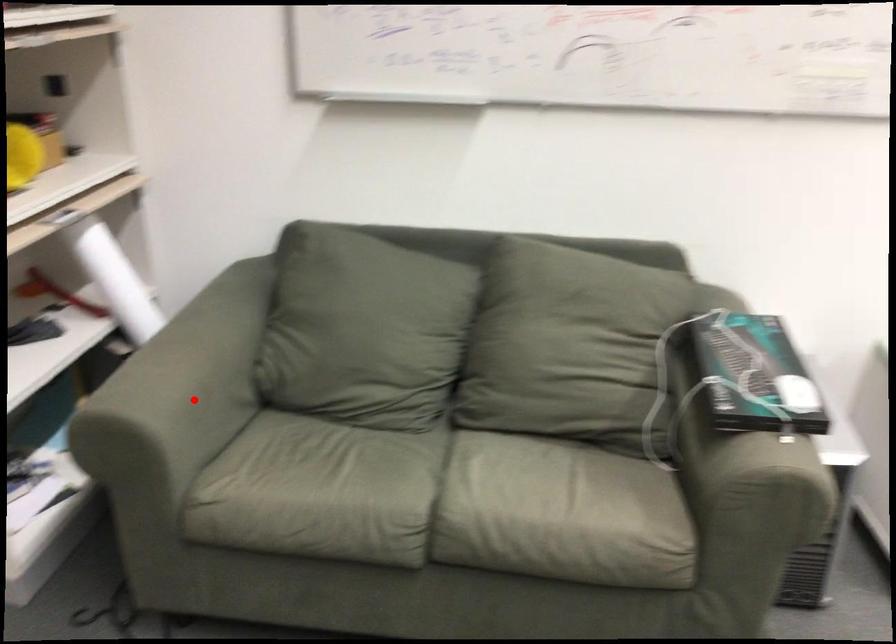
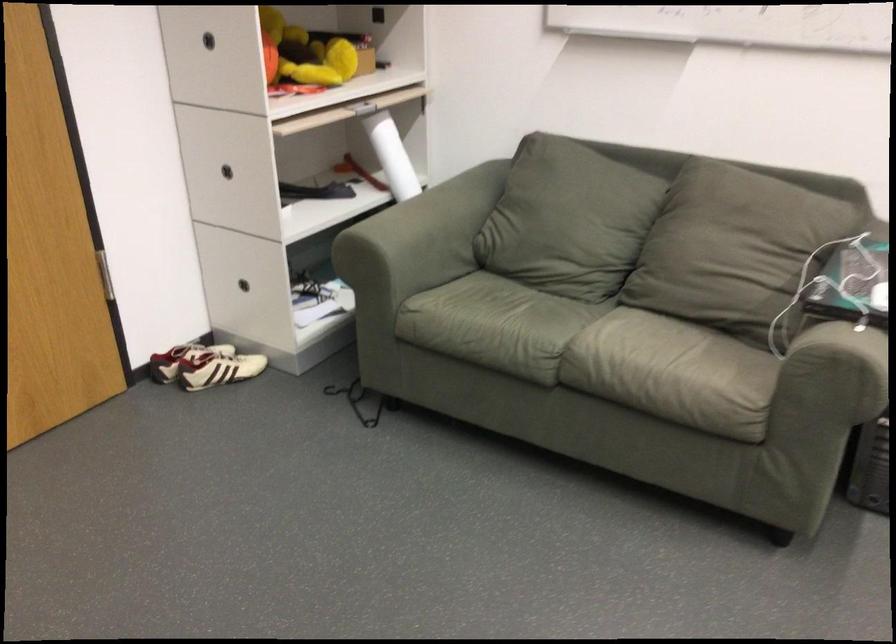
Locate, in the second image, the point that corresponds to the highlighted location in the first image.

(416, 242)